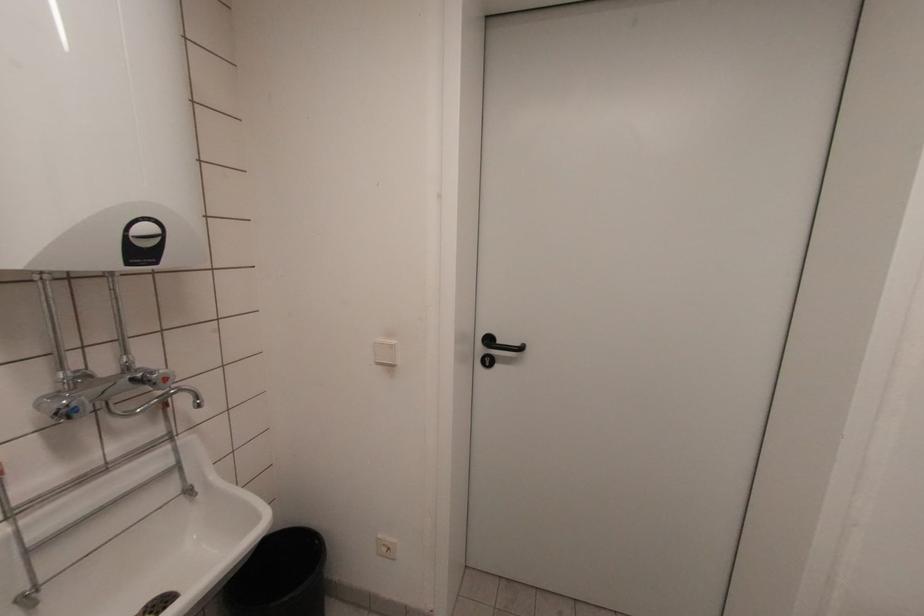
What do you see at coordinates (75, 408) in the screenshot? The height and width of the screenshot is (616, 924). I see `the blue faucet handle` at bounding box center [75, 408].